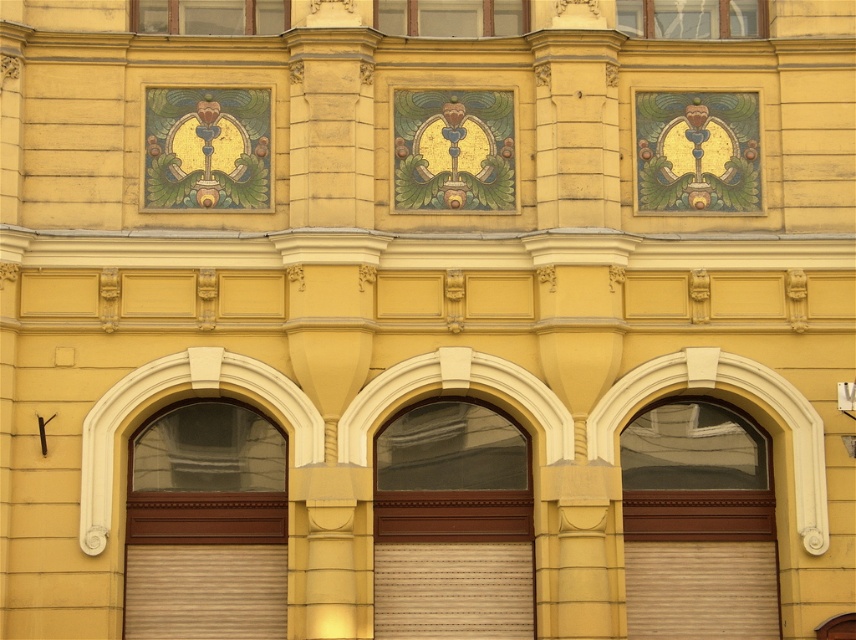
Which is more to the left, brown wooden garage door at center or brown metallic roller door at lower right?

From the viewer's perspective, brown wooden garage door at center appears more on the left side.

Can you confirm if brown wooden garage door at center is smaller than brown metallic roller door at lower right?

Correct, brown wooden garage door at center occupies less space than brown metallic roller door at lower right.

I want to click on brown wooden garage door at center, so click(452, 524).

Does point (733, 568) come in front of point (723, 3)?

Yes, point (733, 568) is in front of point (723, 3).

Is brown metallic roller door at lower right to the right of transparent glass window at upper center from the viewer's perspective?

No, brown metallic roller door at lower right is not to the right of transparent glass window at upper center.

Between point (684, 595) and point (735, 19), which one is positioned in front?

Positioned in front is point (684, 595).

Locate an element on the screen. This screenshot has height=640, width=856. brown metallic roller door at lower right is located at coordinates (697, 524).

Between transparent glass window at upper center and matte glass window at upper center, which one is positioned lower?

matte glass window at upper center

Which of these two, transparent glass window at upper center or matte glass window at upper center, stands shorter?

Standing shorter between the two is matte glass window at upper center.

Which is behind, point (721, 13) or point (206, 0)?

Point (721, 13)

This screenshot has height=640, width=856. Find the location of `transparent glass window at upper center`. transparent glass window at upper center is located at coordinates (691, 19).